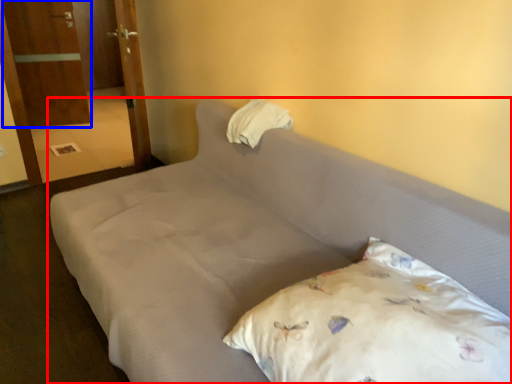
Question: Which object is closer to the camera taking this photo, bed (highlighted by a red box) or armoire (highlighted by a blue box)?

Choices:
 (A) bed
 (B) armoire

Answer: (A)